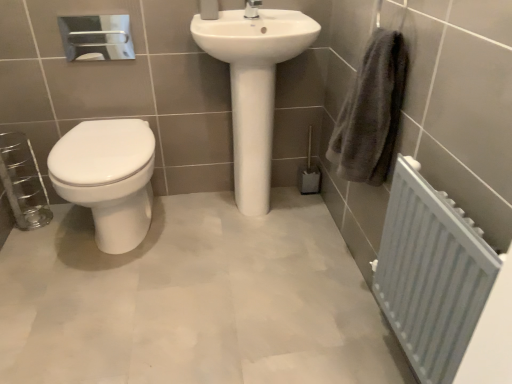
You are a GUI agent. You are given a task and a screenshot of the screen. Output one action in this format:
    pyautogui.click(x=<x>, y=<y>)
    Task: Click on the free space in front of white glossy sink at center
    Image resolution: width=512 pixels, height=384 pixels.
    Given the screenshot: What is the action you would take?
    pyautogui.click(x=252, y=259)